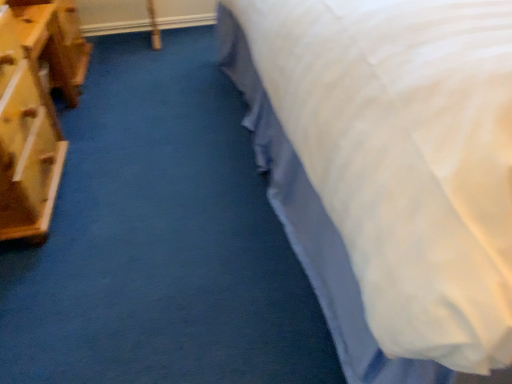
I want to click on wooden chest of drawers at left, so click(x=35, y=109).

Describe the element at coordinates (35, 109) in the screenshot. I see `wooden chest of drawers at left` at that location.

The width and height of the screenshot is (512, 384). What do you see at coordinates (389, 170) in the screenshot?
I see `white textured bed at upper right` at bounding box center [389, 170].

Identify the location of white textured bed at upper right. (389, 170).

Find the location of a particular element. The image size is (512, 384). wooden chest of drawers at left is located at coordinates (35, 109).

Which is more to the left, wooden chest of drawers at left or white textured bed at upper right?

Positioned to the left is wooden chest of drawers at left.

Who is more distant, wooden chest of drawers at left or white textured bed at upper right?

wooden chest of drawers at left is further away from the camera.

Which is farther, (24, 161) or (467, 272)?

The point (24, 161) is farther from the camera.

From the image's perspective, does wooden chest of drawers at left appear higher than white textured bed at upper right?

Yes, from the image's perspective, wooden chest of drawers at left is over white textured bed at upper right.

From a real-world perspective, which object rests below the other?

From a 3D spatial view, white textured bed at upper right is below.

Can you confirm if wooden chest of drawers at left is thinner than white textured bed at upper right?

Yes.

Is wooden chest of drawers at left taller than white textured bed at upper right?

Yes, wooden chest of drawers at left is taller than white textured bed at upper right.

Considering the relative sizes of wooden chest of drawers at left and white textured bed at upper right in the image provided, is wooden chest of drawers at left bigger than white textured bed at upper right?

Yes.

Is wooden chest of drawers at left situated inside white textured bed at upper right or outside?

wooden chest of drawers at left is not enclosed by white textured bed at upper right.

Are wooden chest of drawers at left and white textured bed at upper right beside each other?

No, wooden chest of drawers at left is not making contact with white textured bed at upper right.

In the scene shown: Is wooden chest of drawers at left oriented towards white textured bed at upper right?

Yes, wooden chest of drawers at left is turned towards white textured bed at upper right.

How distant is wooden chest of drawers at left from white textured bed at upper right?

wooden chest of drawers at left and white textured bed at upper right are 34.30 inches apart from each other.

The image size is (512, 384). What are the coordinates of `furniture that appears above the white textured bed at upper right (from the image's perspective)` in the screenshot? It's located at click(35, 109).

Which object is positioned more to the left, white textured bed at upper right or wooden chest of drawers at left?

From the viewer's perspective, wooden chest of drawers at left appears more on the left side.

Considering the relative positions of white textured bed at upper right and wooden chest of drawers at left in the image provided, is white textured bed at upper right behind wooden chest of drawers at left?

No, it is in front of wooden chest of drawers at left.

Considering the points (421, 128) and (76, 54), which point is behind, point (421, 128) or point (76, 54)?

The point (76, 54) is behind.

From the image's perspective, is white textured bed at upper right on top of wooden chest of drawers at left?

No, from the image's perspective, white textured bed at upper right is not above wooden chest of drawers at left.

From a real-world perspective, is white textured bed at upper right positioned under wooden chest of drawers at left based on gravity?

Yes.

Considering the relative sizes of white textured bed at upper right and wooden chest of drawers at left in the image provided, is white textured bed at upper right wider than wooden chest of drawers at left?

Yes, white textured bed at upper right is wider than wooden chest of drawers at left.

Between white textured bed at upper right and wooden chest of drawers at left, which one has less height?

Standing shorter between the two is white textured bed at upper right.

Between white textured bed at upper right and wooden chest of drawers at left, which one has larger size?

wooden chest of drawers at left is bigger.

Is white textured bed at upper right not within wooden chest of drawers at left?

Yes, white textured bed at upper right is outside of wooden chest of drawers at left.

Would you consider white textured bed at upper right to be distant from wooden chest of drawers at left?

No.

Does white textured bed at upper right turn towards wooden chest of drawers at left?

No, white textured bed at upper right is not oriented towards wooden chest of drawers at left.

How different are the orientations of white textured bed at upper right and wooden chest of drawers at left in degrees?

The facing directions of white textured bed at upper right and wooden chest of drawers at left are 88.4 degrees apart.

How much distance is there between white textured bed at upper right and wooden chest of drawers at left?

white textured bed at upper right and wooden chest of drawers at left are 34.30 inches apart.

Identify the location of bed in front of the wooden chest of drawers at left. This screenshot has height=384, width=512. (389, 170).

You are a GUI agent. You are given a task and a screenshot of the screen. Output one action in this format:
    pyautogui.click(x=<x>, y=<y>)
    Task: Click on the bed below the wooden chest of drawers at left (from a real-world perspective)
    The image size is (512, 384).
    Given the screenshot: What is the action you would take?
    pyautogui.click(x=389, y=170)

Where is `bed below the wooden chest of drawers at left (from the image's perspective)`? bed below the wooden chest of drawers at left (from the image's perspective) is located at coordinates (389, 170).